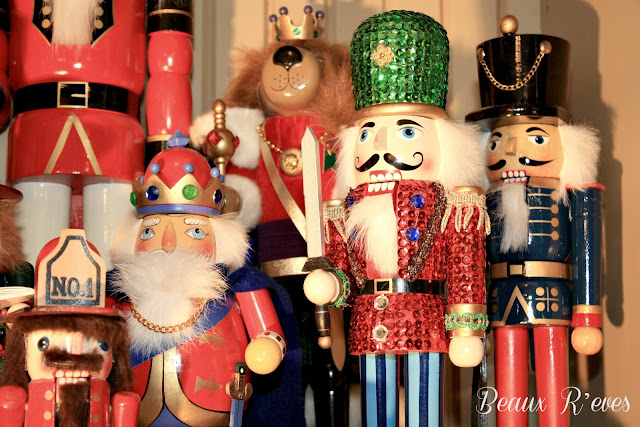
You are a GUI agent. You are given a task and a screenshot of the screen. Output one action in this format:
    pyautogui.click(x=<x>, y=<y>)
    Task: Click on the nutcrackers
    This screenshot has height=427, width=640.
    Given the screenshot: What is the action you would take?
    pyautogui.click(x=202, y=286), pyautogui.click(x=452, y=247), pyautogui.click(x=552, y=230), pyautogui.click(x=262, y=143), pyautogui.click(x=99, y=75)